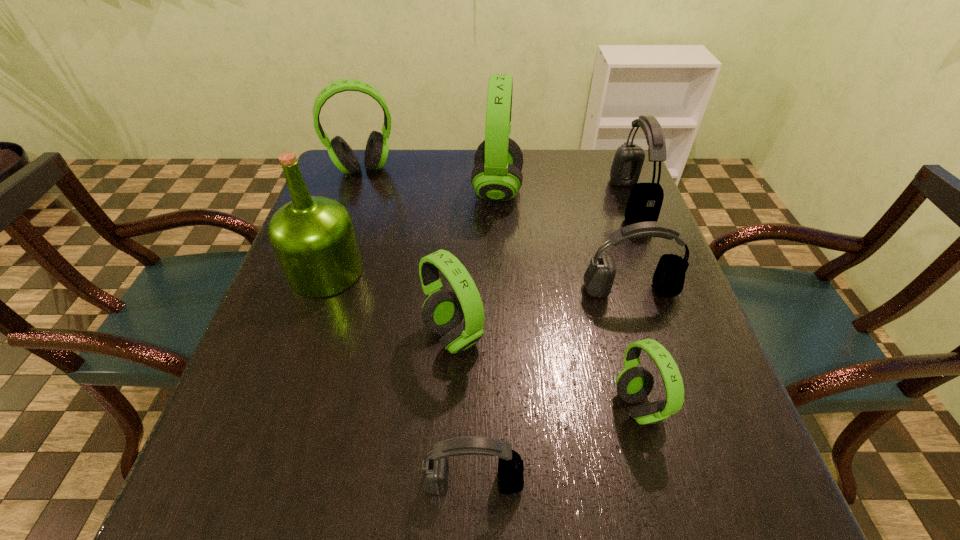
Locate an element on the screen. The height and width of the screenshot is (540, 960). vacant point located 0.200m on the headband of the second farthest black headset is located at coordinates (660, 383).

Where is `vacant space located on the left of the nearest green headset`? vacant space located on the left of the nearest green headset is located at coordinates (587, 406).

You are a GUI agent. You are given a task and a screenshot of the screen. Output one action in this format:
    pyautogui.click(x=<x>, y=<y>)
    Task: Click on the object that is at the near edge
    
    Given the screenshot: What is the action you would take?
    pyautogui.click(x=435, y=468)

This screenshot has height=540, width=960. I want to click on olive oil present at the left edge, so click(313, 237).

This screenshot has height=540, width=960. I want to click on headset present at the left edge, so click(x=377, y=148).

At what (x,y) coordinates should I click in order to perform the action: click on object located in the far left corner section of the desktop. Please return your answer as a coordinate pair (x, y). The image size is (960, 540). Looking at the image, I should click on (377, 148).

At what (x,y) coordinates should I click in order to perform the action: click on object located at the far right corner. Please return your answer as a coordinate pair (x, y). This screenshot has height=540, width=960. Looking at the image, I should click on (645, 200).

Image resolution: width=960 pixels, height=540 pixels. In the image, there is a desktop. What are the coordinates of `vacant space at the far edge` in the screenshot? It's located at (525, 188).

Find the location of `vacant space at the near edge of the desktop`. vacant space at the near edge of the desktop is located at coordinates (588, 478).

Where is `vacant space at the left edge of the desktop`? vacant space at the left edge of the desktop is located at coordinates (331, 328).